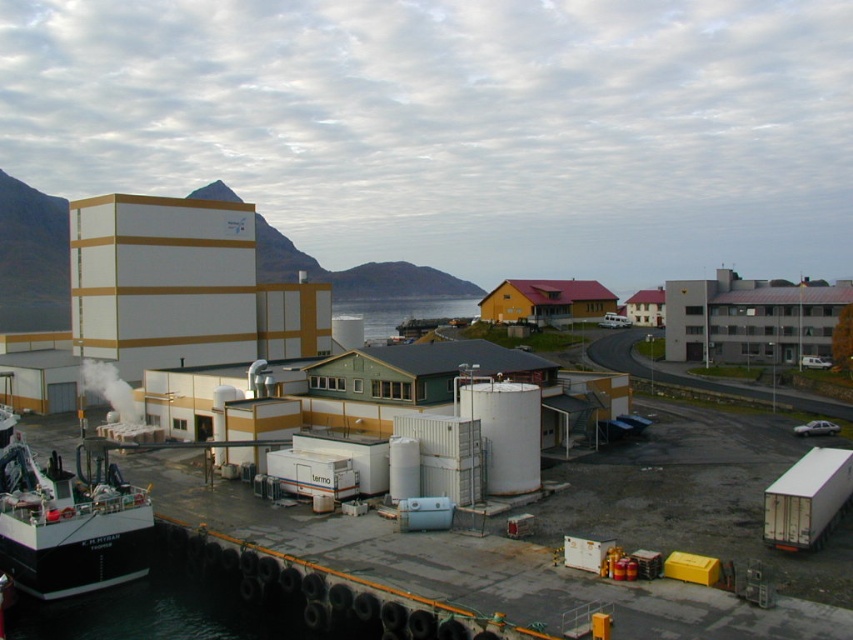
Is black matte boat at lower left to the right of transparent water at center from the viewer's perspective?

No, black matte boat at lower left is not to the right of transparent water at center.

Is point (119, 529) farther from viewer compared to point (364, 308)?

No, (119, 529) is in front of (364, 308).

The height and width of the screenshot is (640, 853). Identify the location of black matte boat at lower left. (67, 524).